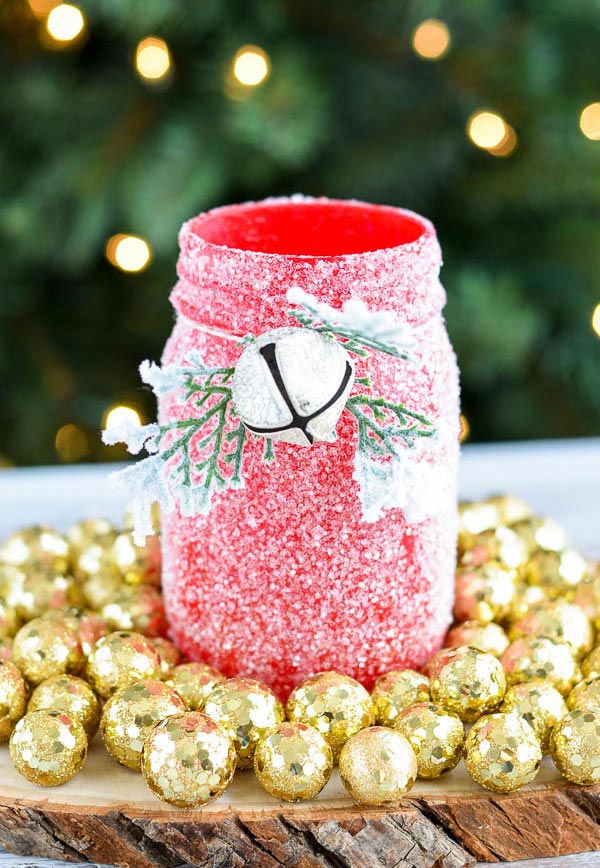
The width and height of the screenshot is (600, 868). What are the coordinates of `blurry christmas tree background` in the screenshot? It's located at (334, 27).